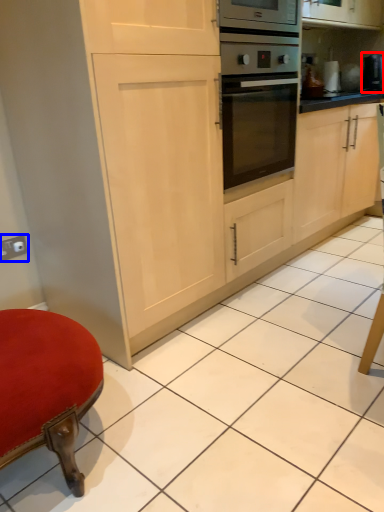
Question: Which of the following is the farthest to the observer, appliance (highlighted by a red box) or electric outlet (highlighted by a blue box)?

Choices:
 (A) appliance
 (B) electric outlet

Answer: (A)